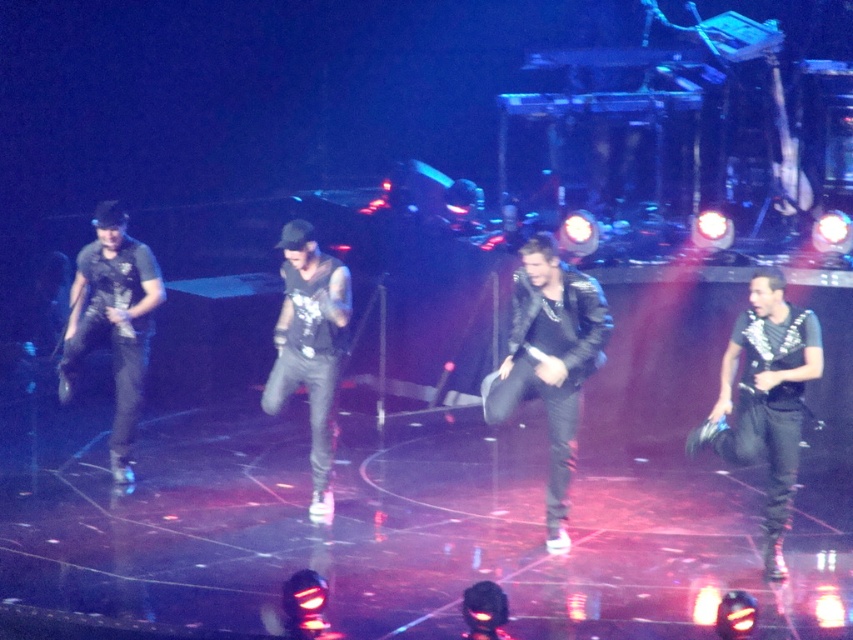
Which is more to the left, matte black vest at left or black leather pants at center?

From the viewer's perspective, matte black vest at left appears more on the left side.

Is point (143, 332) closer to viewer compared to point (303, 262)?

No.

In order to click on matte black vest at left in this screenshot , I will do `click(113, 321)`.

Is leather jacket at center shorter than black leather jacket at right?

No, leather jacket at center is not shorter than black leather jacket at right.

Is point (556, 388) closer to camera compared to point (761, 314)?

No, it is behind (761, 314).

Locate an element on the screen. leather jacket at center is located at coordinates (550, 360).

Consider the image. Does black leather jacket at right have a smaller size compared to black leather pants at center?

Yes.

Is point (743, 428) less distant than point (280, 387)?

Yes, it is in front of point (280, 387).

Is point (752, 339) farther from viewer compared to point (306, 259)?

That is False.

This screenshot has height=640, width=853. I want to click on black leather jacket at right, so click(x=766, y=397).